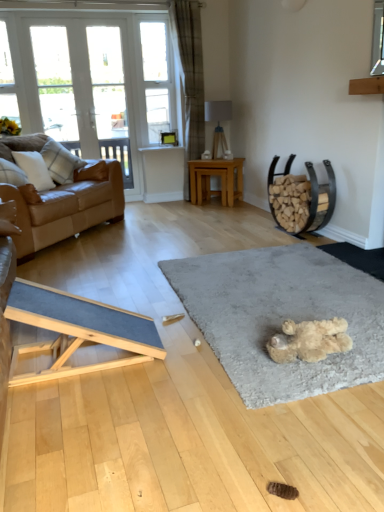
Where is `vacant area that is in front of wooden ramp at lower left, acting as the second table starting from the right`? The image size is (384, 512). vacant area that is in front of wooden ramp at lower left, acting as the second table starting from the right is located at coordinates (95, 414).